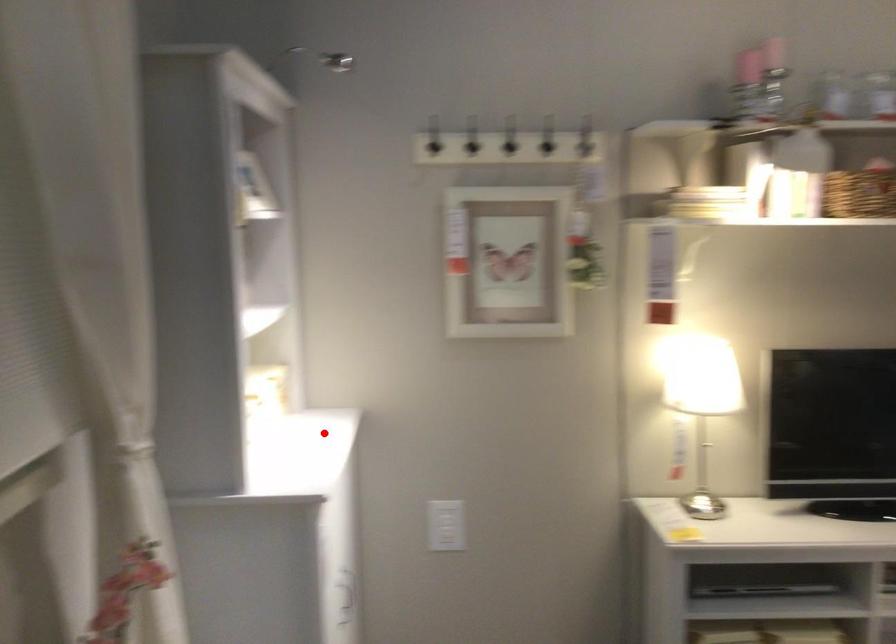
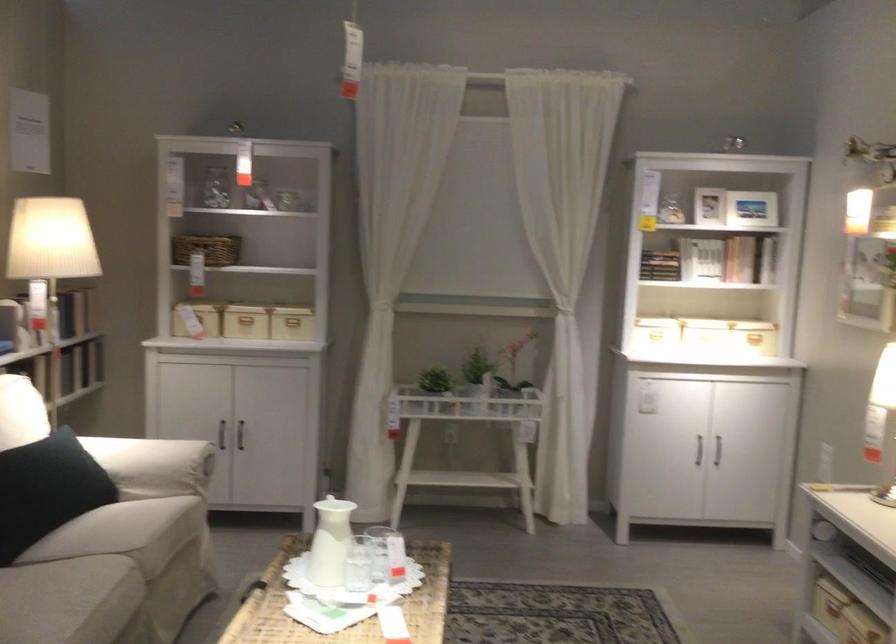
Question: I am providing you with two images of the same scene from different viewpoints. Image1 has a red point marked. In image2, the corresponding 3D location appears at what relative position? Reply with the corresponding letter.

Choices:
 (A) Closer
 (B) Farther

Answer: (B)